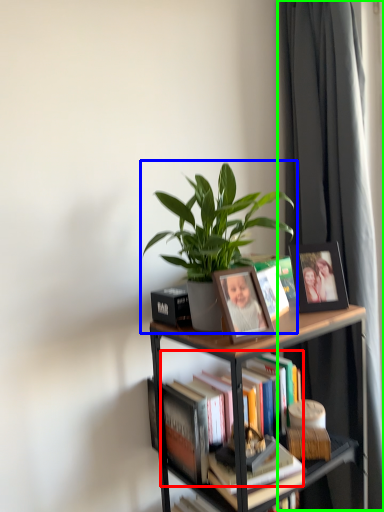
Question: Which object is the farthest from book (highlighted by a red box)? Choose among these: houseplant (highlighted by a blue box) or curtain (highlighted by a green box).

Choices:
 (A) houseplant
 (B) curtain

Answer: (B)